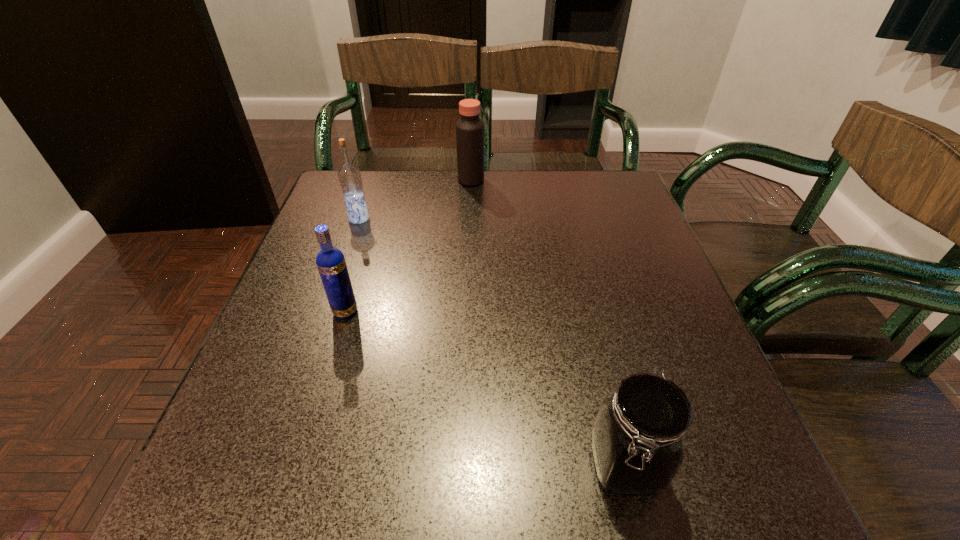
Image resolution: width=960 pixels, height=540 pixels. I want to click on free spot between the vinegar and the second nearest object, so click(x=408, y=246).

The image size is (960, 540). What are the coordinates of `free spot between the second nearest object and the farther vodka` in the screenshot? It's located at (352, 265).

Locate an element on the screen. The width and height of the screenshot is (960, 540). vacant space that's between the rightmost object and the farthest object is located at coordinates (548, 322).

Where is `vacant region between the third object from left to right and the farther vodka`? The height and width of the screenshot is (540, 960). vacant region between the third object from left to right and the farther vodka is located at coordinates (415, 199).

Find the location of a particular element. The height and width of the screenshot is (540, 960). vacant area that lies between the vinegar and the nearest object is located at coordinates coord(548,322).

Identify the location of vacant area that lies between the second nearest object and the farther vodka. (352, 265).

Where is `empty space between the farther vodka and the jar`? empty space between the farther vodka and the jar is located at coordinates (492, 342).

Identify the location of empty space that is in between the vinegar and the second nearest object. This screenshot has width=960, height=540. (408, 246).

Locate an element on the screen. This screenshot has height=540, width=960. vacant area that lies between the third object from left to right and the nearest object is located at coordinates (548, 322).

Identify which object is the third closest to the third farthest object. Please provide its 2D coordinates. Your answer should be formatted as a tuple, i.e. [(x, y)], where the tuple contains the x and y coordinates of a point satisfying the conditions above.

[(469, 128)]